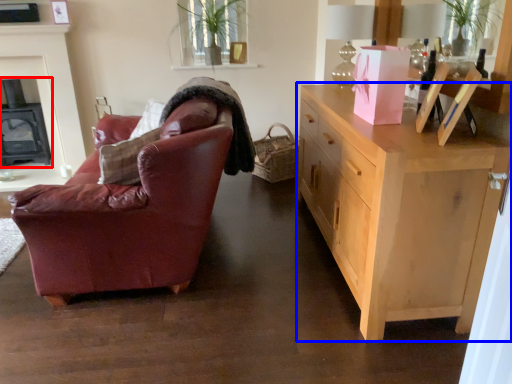
Question: Which object appears closest to the camera in this image, fireplace (highlighted by a red box) or cabinetry (highlighted by a blue box)?

Choices:
 (A) fireplace
 (B) cabinetry

Answer: (B)